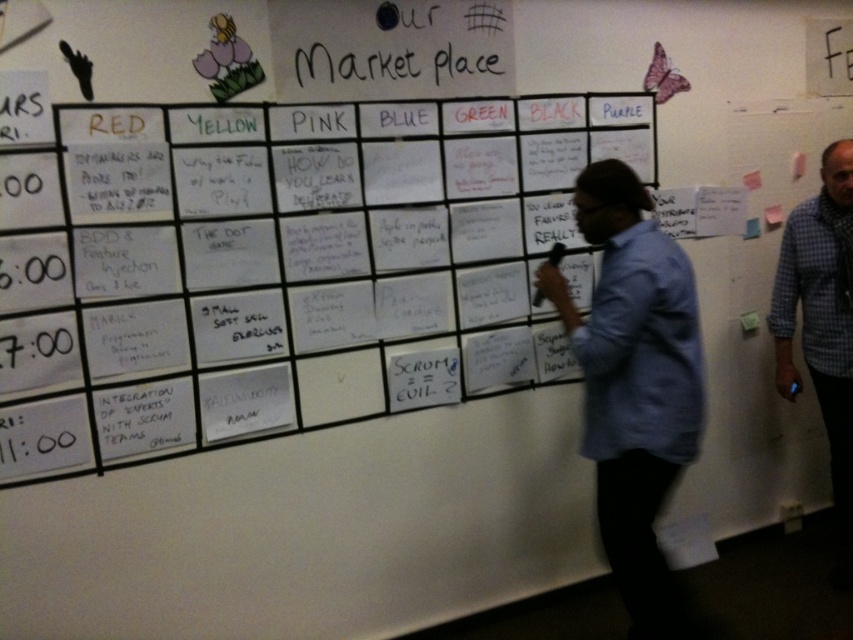
You are standing 5 feet away from the wall with the grid of papers. You want to pick up the white paper at center. Can you reach it without moving closer?

The white paper at center is 6.11 feet from the camera. Since you are standing 5 feet away, you are already closer than the required distance. Therefore, you can reach the white paper at center without needing to move closer.

You are standing 2 meters away from a wall with a grid of notes. You want to read a note located at point (651, 368) on the wall. Can you reach it without moving closer?

The point (651, 368) is 1.97 meters away from the camera, so yes, you can reach it without moving closer since you are already at 2 meters distance.

You are organizing a meeting and need to present the brainstorming wall. You have a blue shirt at center and a white paper at center. Which item is positioned higher on the wall?

The white paper at center is located above the blue shirt at center, so it is positioned higher on the wall.